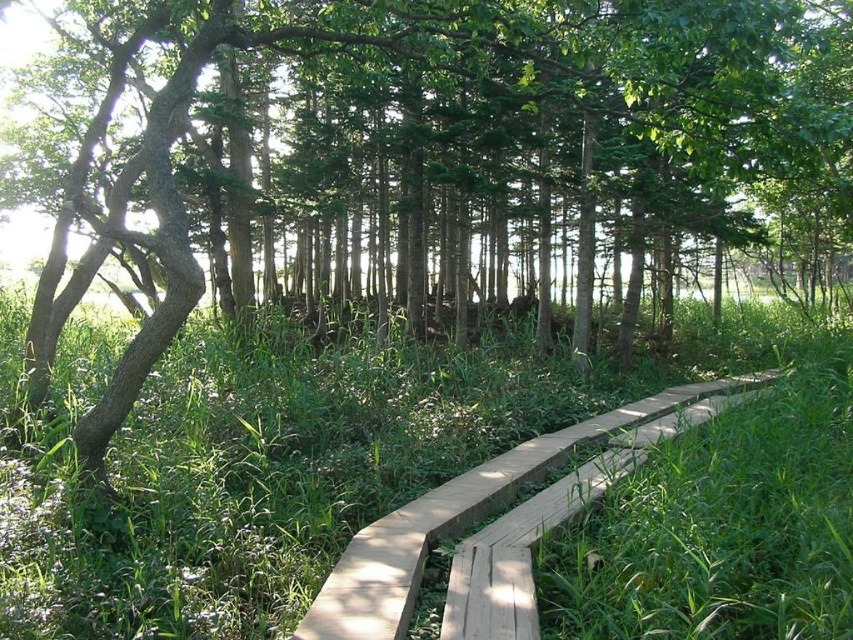
Question: Is green grass at center closer to camera compared to natural wood boardwalk at center?

Choices:
 (A) yes
 (B) no

Answer: (A)

Question: Which point is farther to the camera?

Choices:
 (A) (604, 435)
 (B) (747, 548)

Answer: (A)

Question: Is green grass at center thinner than natural wood boardwalk at center?

Choices:
 (A) no
 (B) yes

Answer: (A)

Question: Is the position of green grass at center less distant than that of natural wood boardwalk at center?

Choices:
 (A) yes
 (B) no

Answer: (A)